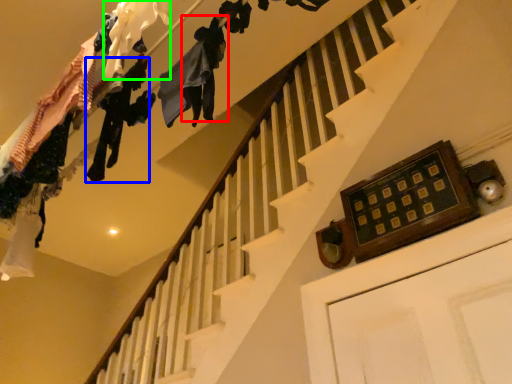
Question: Which is farther away from clothing (highlighted by a red box)? clothing (highlighted by a blue box) or clothing (highlighted by a green box)?

Choices:
 (A) clothing
 (B) clothing

Answer: (A)